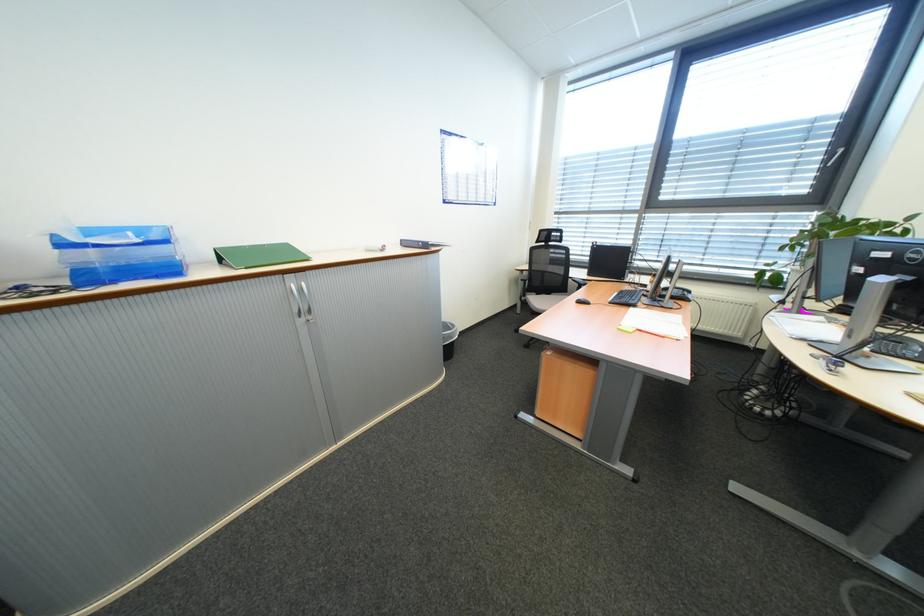
Image resolution: width=924 pixels, height=616 pixels. I want to click on black trash can, so click(447, 339).